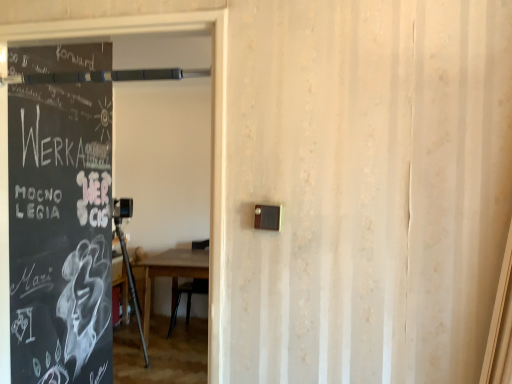
In order to face black chalkboard at left, should I rotate leftwards or rightwards?

To align with it, rotate left about 21.077°.

Where is `black chalkboard at left`? black chalkboard at left is located at coordinates [x=213, y=124].

The height and width of the screenshot is (384, 512). Describe the element at coordinates (213, 124) in the screenshot. I see `black chalkboard at left` at that location.

This screenshot has width=512, height=384. What do you see at coordinates (170, 273) in the screenshot? I see `wooden table at center` at bounding box center [170, 273].

Locate an element on the screen. This screenshot has height=384, width=512. wooden table at center is located at coordinates (170, 273).

Where is `black chalkboard at left`? This screenshot has height=384, width=512. black chalkboard at left is located at coordinates (213, 124).

In the scene shown: Is black chalkboard at left at the right side of wooden table at center?

Correct, you'll find black chalkboard at left to the right of wooden table at center.

Is black chalkboard at left behind wooden table at center?

No, black chalkboard at left is closer to the camera.

Which is less distant, (x=4, y=114) or (x=140, y=266)?

Point (x=4, y=114) is positioned closer to the camera compared to point (x=140, y=266).

From the image's perspective, relative to wooden table at center, is black chalkboard at left above or below?

black chalkboard at left is above wooden table at center.

From a real-world perspective, relative to wooden table at center, is black chalkboard at left vertically above or below?

black chalkboard at left is above wooden table at center.

Considering the sizes of objects black chalkboard at left and wooden table at center in the image provided, who is thinner, black chalkboard at left or wooden table at center?

With smaller width is black chalkboard at left.

Is black chalkboard at left taller than wooden table at center?

Indeed, black chalkboard at left has a greater height compared to wooden table at center.

Can you confirm if black chalkboard at left is bigger than wooden table at center?

Actually, black chalkboard at left might be smaller than wooden table at center.

Is wooden table at center completely or partially inside black chalkboard at left?

No, wooden table at center is not inside black chalkboard at left.

Is black chalkboard at left not close to wooden table at center?

black chalkboard at left is far away from wooden table at center.

Is black chalkboard at left aimed at wooden table at center?

No, black chalkboard at left is not oriented towards wooden table at center.

How distant is black chalkboard at left from wooden table at center?

black chalkboard at left is 8.18 feet away from wooden table at center.

Locate an element on the screen. This screenshot has width=512, height=384. garage door above the wooden table at center (from a real-world perspective) is located at coordinates point(213,124).

Is wooden table at center at the right side of black chalkboard at left?

Incorrect, wooden table at center is not on the right side of black chalkboard at left.

Which object is further away from the camera, wooden table at center or black chalkboard at left?

wooden table at center is behind.

Which is closer to the camera, (170, 268) or (3, 321)?

Point (170, 268) appears to be farther away from the viewer than point (3, 321).

From the image's perspective, which one is positioned lower, wooden table at center or black chalkboard at left?

wooden table at center is shown below in the image.

From a real-world perspective, is wooden table at center above or below black chalkboard at left?

wooden table at center is situated lower than black chalkboard at left in the real world.

Which object is wider, wooden table at center or black chalkboard at left?

wooden table at center is wider.

In the scene shown: Considering the sizes of objects wooden table at center and black chalkboard at left in the image provided, who is taller, wooden table at center or black chalkboard at left?

With more height is black chalkboard at left.

Who is bigger, wooden table at center or black chalkboard at left?

With larger size is wooden table at center.

Do you think wooden table at center is within black chalkboard at left, or outside of it?

wooden table at center exists outside the volume of black chalkboard at left.

Is wooden table at center next to black chalkboard at left?

wooden table at center is not next to black chalkboard at left, and they're not touching.

Does wooden table at center turn towards black chalkboard at left?

Yes, wooden table at center faces towards black chalkboard at left.

Can you tell me how much wooden table at center and black chalkboard at left differ in facing direction?

wooden table at center and black chalkboard at left are facing 0.399 degrees away from each other.

Identify the location of garage door that appears above the wooden table at center (from a real-world perspective). The image size is (512, 384). (213, 124).

In order to click on table located behind the black chalkboard at left in this screenshot , I will do `click(170, 273)`.

I want to click on table below the black chalkboard at left (from the image's perspective), so click(170, 273).